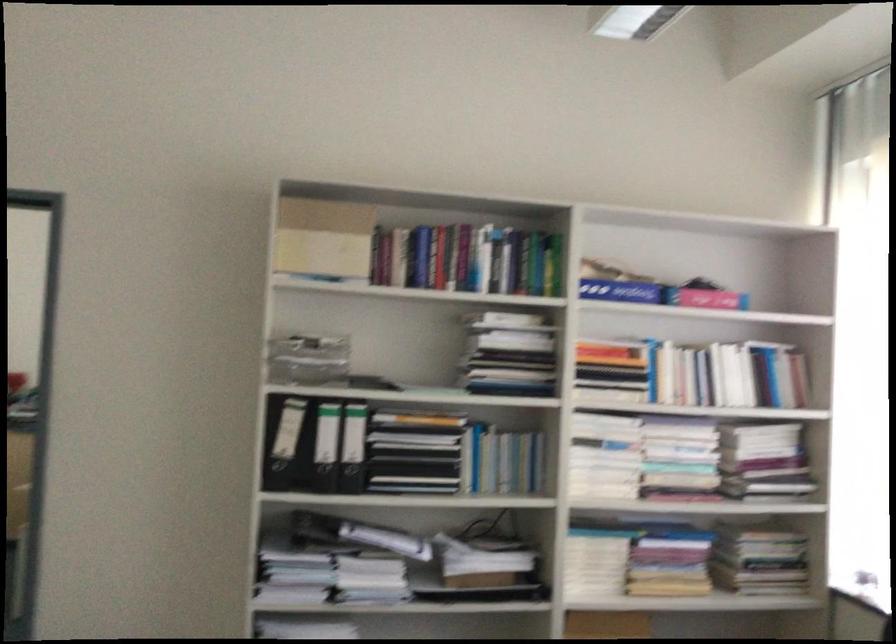
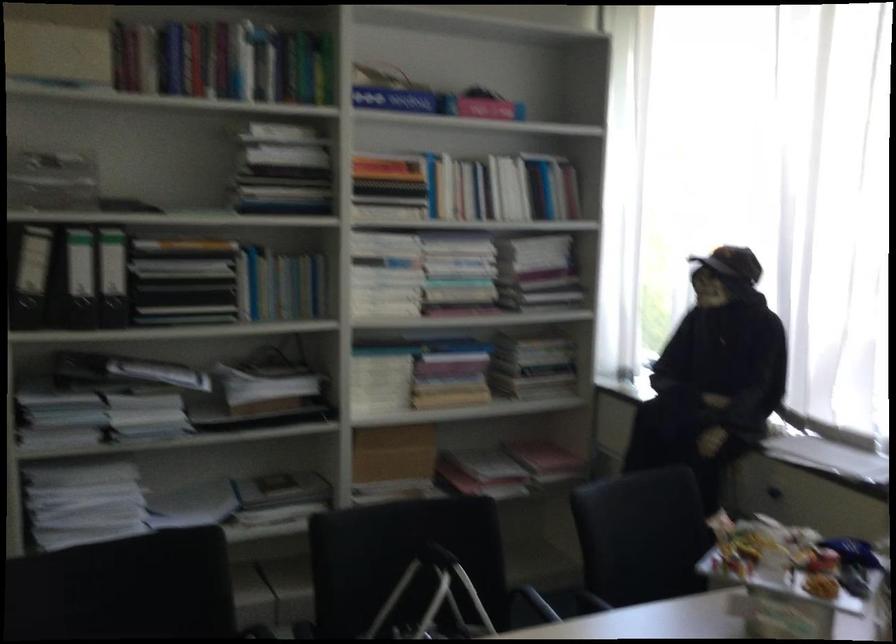
The point at (606, 457) is marked in the first image. Where is the corresponding point in the second image?

(385, 274)